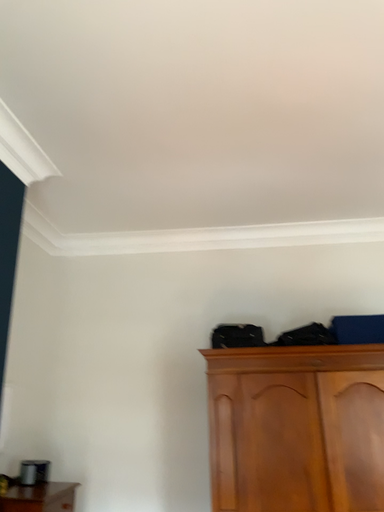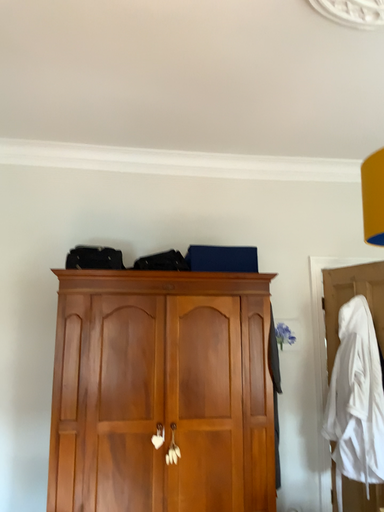
Question: How did the camera likely rotate when shooting the video?

Choices:
 (A) rotated left
 (B) rotated right

Answer: (B)